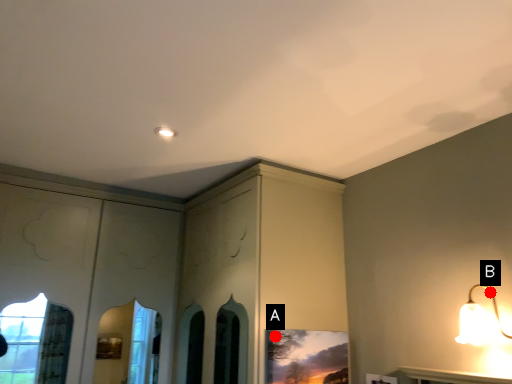
Question: Two points are circled on the image, labeled by A and B beside each circle. Which of the following is the closest to the observer?

Choices:
 (A) A is closer
 (B) B is closer

Answer: (B)